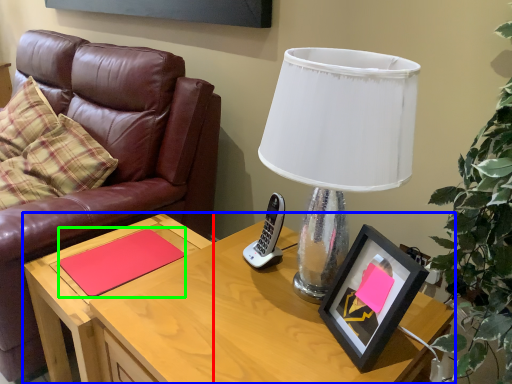
Question: Which object is the closest to the side table (highlighted by a red box)? Choose among these: desk (highlighted by a blue box) or notepad (highlighted by a green box).

Choices:
 (A) desk
 (B) notepad

Answer: (B)